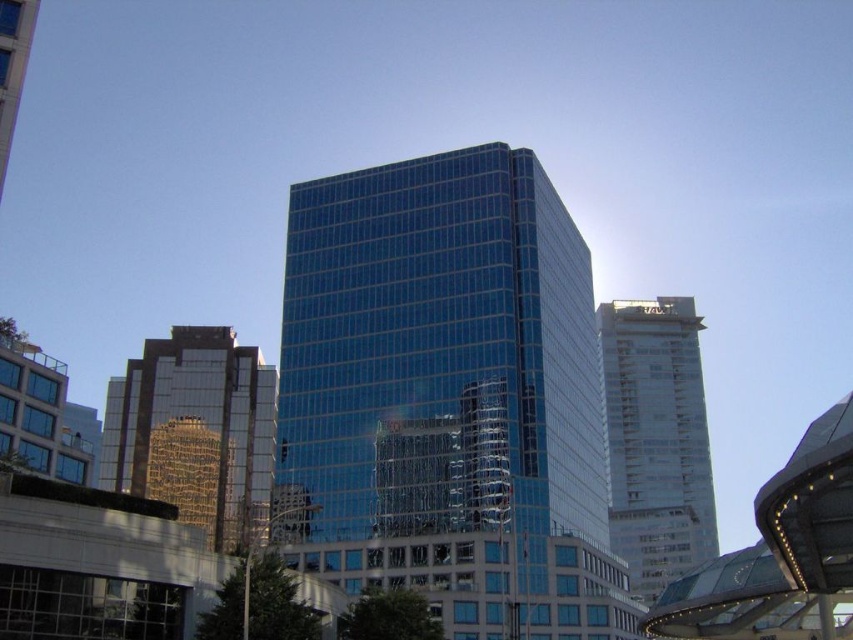
You are standing at the point marked as point (500, 598) in the urban landscape. A drone needs to deliver a package to you. The drone can only fly 200 feet. Will it be able to reach you?

The point (500, 598) is 219.92 feet away from the viewer, so the drone cannot reach you as it exceeds the 200 feet limit.

You are a city planner analyzing the urban layout. You need to determine the spatial relationship between the reflective glass building at left and the white glass tower at right. Which one is positioned to the left of the other?

The reflective glass building at left is positioned to the left of the white glass tower at right.